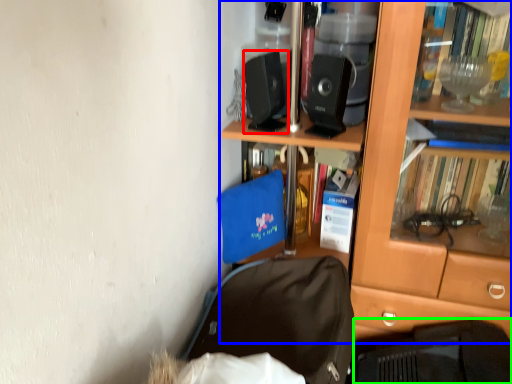
Question: Which object is the farthest from loudspeaker (highlighted by a red box)? Choose among these: bookcase (highlighted by a blue box) or laptop (highlighted by a green box).

Choices:
 (A) bookcase
 (B) laptop

Answer: (B)